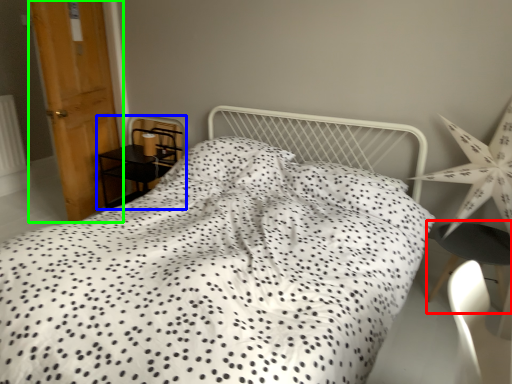
Question: Which is nearer to the table (highlighted by a red box)? furniture (highlighted by a blue box) or door (highlighted by a green box).

Choices:
 (A) furniture
 (B) door

Answer: (A)